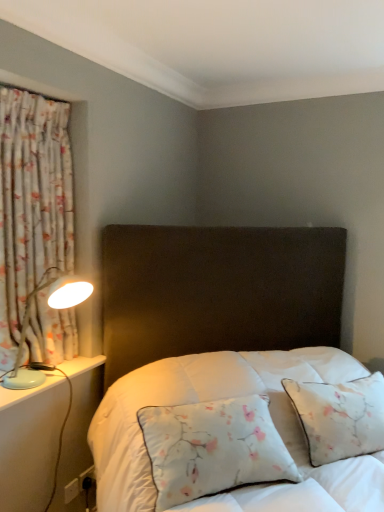
Question: Is the depth of floral fabric curtain at left greater than that of floral fabric pillow at center?

Choices:
 (A) yes
 (B) no

Answer: (A)

Question: Is floral fabric curtain at left not near floral fabric pillow at center?

Choices:
 (A) yes
 (B) no

Answer: (B)

Question: Does floral fabric curtain at left have a larger size compared to floral fabric pillow at center?

Choices:
 (A) no
 (B) yes

Answer: (A)

Question: From the image's perspective, is floral fabric curtain at left on floral fabric pillow at center?

Choices:
 (A) no
 (B) yes

Answer: (B)

Question: From the image's perspective, is floral fabric curtain at left located beneath floral fabric pillow at center?

Choices:
 (A) yes
 (B) no

Answer: (B)

Question: Considering the positions of floral fabric curtain at left and floral fabric pillow at center in the image, is floral fabric curtain at left bigger or smaller than floral fabric pillow at center?

Choices:
 (A) small
 (B) big

Answer: (A)

Question: In the image, is floral fabric curtain at left on the left side or the right side of floral fabric pillow at center?

Choices:
 (A) left
 (B) right

Answer: (A)

Question: In terms of width, does floral fabric curtain at left look wider or thinner when compared to floral fabric pillow at center?

Choices:
 (A) thin
 (B) wide

Answer: (A)

Question: Considering their positions, is floral fabric curtain at left located in front of or behind floral fabric pillow at center?

Choices:
 (A) behind
 (B) front

Answer: (A)

Question: From a real-world perspective, relative to light blue plastic table lamp at left, is white plastic electric outlet at lower left vertically above or below?

Choices:
 (A) above
 (B) below

Answer: (B)

Question: Would you say white plastic electric outlet at lower left is to the left or to the right of light blue plastic table lamp at left in the picture?

Choices:
 (A) left
 (B) right

Answer: (B)

Question: From the image's perspective, is white plastic electric outlet at lower left positioned above or below light blue plastic table lamp at left?

Choices:
 (A) above
 (B) below

Answer: (B)

Question: Does point (72, 484) appear closer or farther from the camera than point (52, 367)?

Choices:
 (A) closer
 (B) farther

Answer: (B)

Question: Is floral fabric curtain at left taller or shorter than white plastic electric outlet at lower left?

Choices:
 (A) tall
 (B) short

Answer: (A)

Question: Would you say floral fabric curtain at left is inside or outside white plastic electric outlet at lower left?

Choices:
 (A) inside
 (B) outside

Answer: (B)